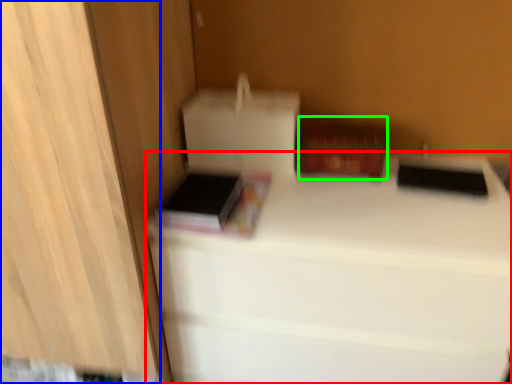
Question: Considering the real-world distances, which object is closest to furniture (highlighted by a red box)? cabinetry (highlighted by a blue box) or cardboard box (highlighted by a green box).

Choices:
 (A) cabinetry
 (B) cardboard box

Answer: (B)